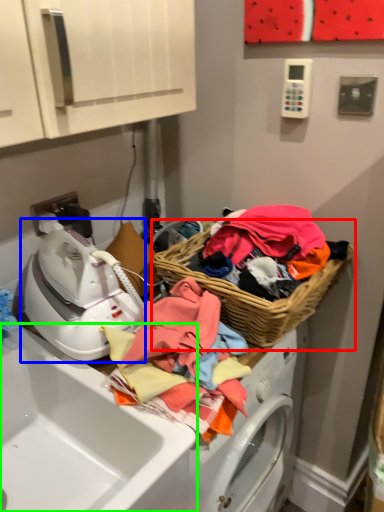
Question: Which is nearer to the picnic basket (highlighted by a red box)? washer (highlighted by a blue box) or sink (highlighted by a green box).

Choices:
 (A) washer
 (B) sink

Answer: (A)